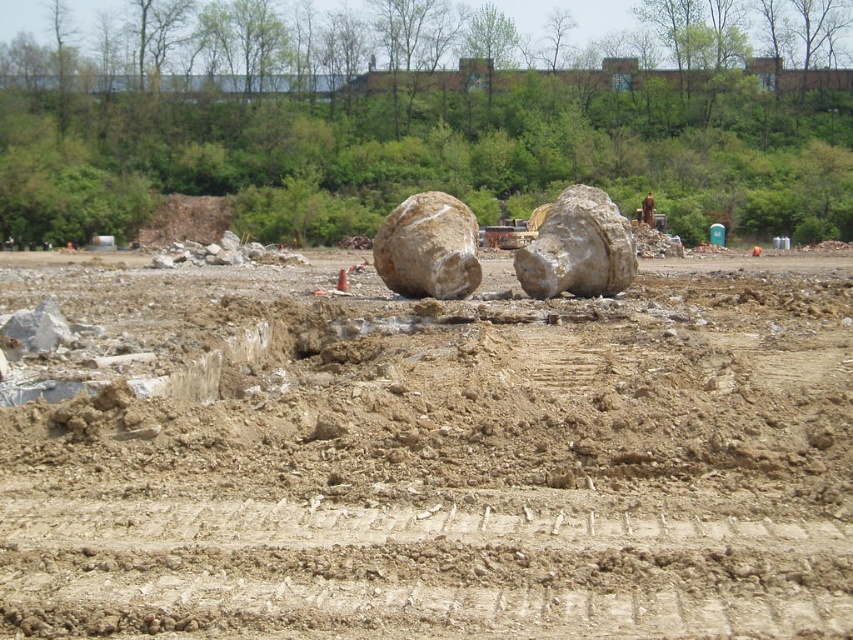
Question: Can you confirm if brown sandy dirt at center is positioned to the left of rough beige boulder at center?

Choices:
 (A) no
 (B) yes

Answer: (B)

Question: Which object is the closest to the rough beige boulder at center?

Choices:
 (A) smooth gray rock at center
 (B) brown sandy dirt at center

Answer: (A)

Question: Which of the following is the farthest from the observer?

Choices:
 (A) (401, 515)
 (B) (590, 225)

Answer: (B)

Question: Is smooth gray rock at center thinner than rough beige boulder at center?

Choices:
 (A) no
 (B) yes

Answer: (A)

Question: Can you confirm if brown sandy dirt at center is wider than rough beige boulder at center?

Choices:
 (A) no
 (B) yes

Answer: (B)

Question: Among these objects, which one is nearest to the camera?

Choices:
 (A) brown sandy dirt at center
 (B) rough beige boulder at center
 (C) smooth gray rock at center

Answer: (A)